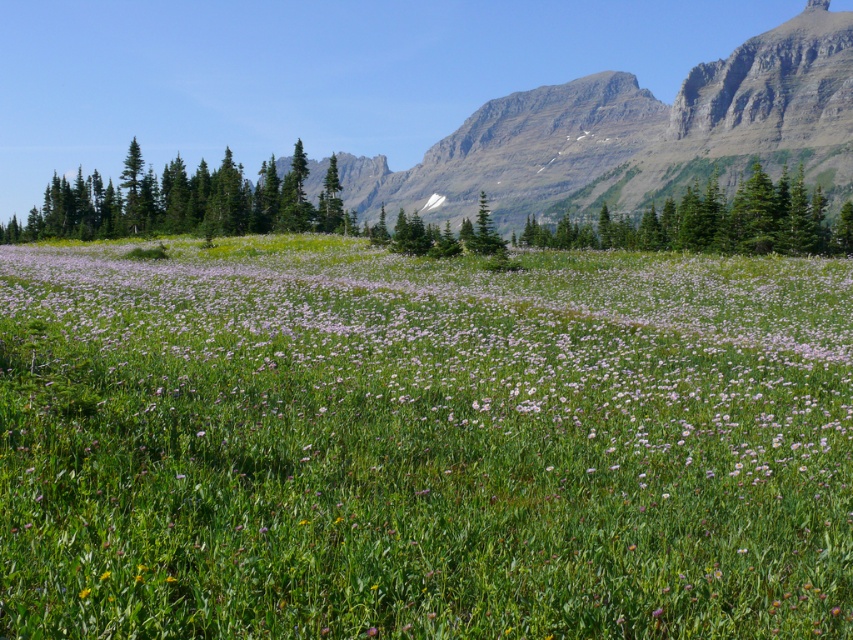
You are standing in the alpine meadow scene and want to take a photo of the green matte trees at left. According to the scene description, where should you position yourself to capture them in the frame?

To capture the green matte trees at left in the frame, position yourself so that the trees are centered at the 2D coordinates point (181, 202) as specified in the scene description.

You are a hiker who wants to cross the alpine meadow. You notice the pink soft grass at center and the green textured pine tree at center. Which one has a smaller width?

The pink soft grass at center has a smaller width than the green textured pine tree at center.

You are standing in the alpine meadow and notice two trees at the center of the scene. Which tree is positioned lower in the image, the green textured pine tree at center or the green matte tree at center?

The green textured pine tree at center is positioned lower because it is described as being below the green matte tree at center.